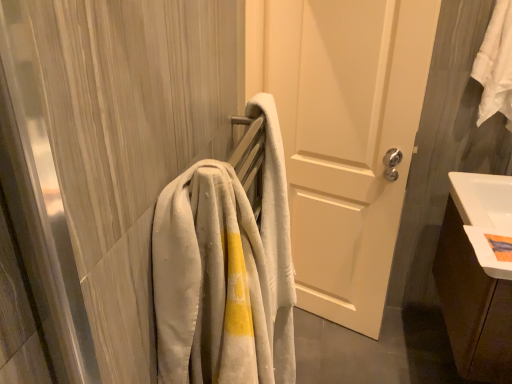
Question: Should I look upward or downward to see white matte door at center?

Choices:
 (A) down
 (B) up

Answer: (B)

Question: Is white cotton towel at upper right turned away from light gray plush towel at left?

Choices:
 (A) no
 (B) yes

Answer: (A)

Question: Is white cotton towel at upper right oriented towards light gray plush towel at left?

Choices:
 (A) yes
 (B) no

Answer: (B)

Question: Does white cotton towel at upper right appear on the left side of light gray plush towel at left?

Choices:
 (A) no
 (B) yes

Answer: (A)

Question: Can you confirm if white cotton towel at upper right is thinner than light gray plush towel at left?

Choices:
 (A) yes
 (B) no

Answer: (A)

Question: Is the depth of white cotton towel at upper right greater than that of light gray plush towel at left?

Choices:
 (A) no
 (B) yes

Answer: (B)

Question: From the image's perspective, is white cotton towel at upper right on top of light gray plush towel at left?

Choices:
 (A) yes
 (B) no

Answer: (A)

Question: Can you confirm if brown wood cabinet at lower right is smaller than white cotton towel at upper right?

Choices:
 (A) yes
 (B) no

Answer: (B)

Question: From a real-world perspective, is brown wood cabinet at lower right located beneath white cotton towel at upper right?

Choices:
 (A) yes
 (B) no

Answer: (A)

Question: Considering the relative sizes of brown wood cabinet at lower right and white cotton towel at upper right in the image provided, is brown wood cabinet at lower right thinner than white cotton towel at upper right?

Choices:
 (A) no
 (B) yes

Answer: (A)

Question: Is brown wood cabinet at lower right further to the viewer compared to white cotton towel at upper right?

Choices:
 (A) yes
 (B) no

Answer: (B)

Question: Is brown wood cabinet at lower right directly adjacent to white cotton towel at upper right?

Choices:
 (A) yes
 (B) no

Answer: (B)

Question: Considering the relative sizes of brown wood cabinet at lower right and white cotton towel at upper right in the image provided, is brown wood cabinet at lower right wider than white cotton towel at upper right?

Choices:
 (A) no
 (B) yes

Answer: (B)

Question: Does light gray plush towel at left lie in front of brown wood cabinet at lower right?

Choices:
 (A) yes
 (B) no

Answer: (A)